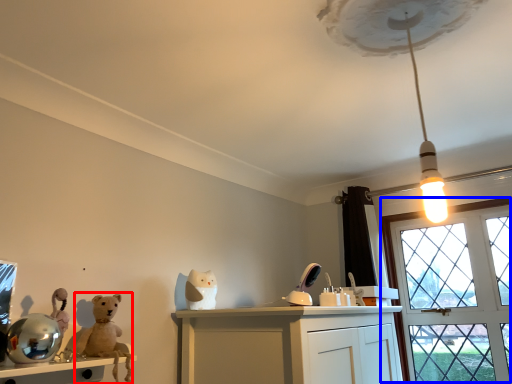
Question: Which of the following is the farthest to the observer, animal (highlighted by a red box) or window (highlighted by a blue box)?

Choices:
 (A) animal
 (B) window

Answer: (B)